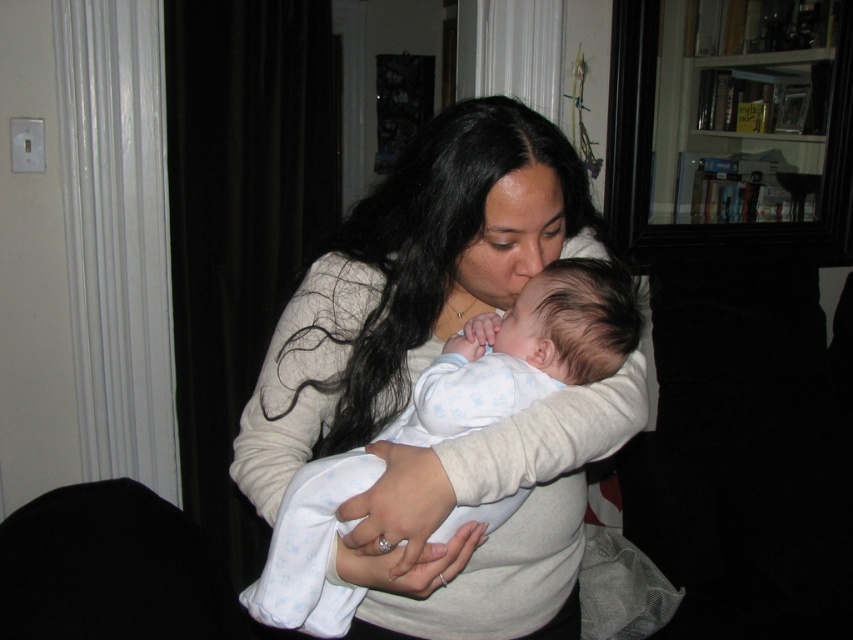
Consider the image. Is white soft sweater at center to the right of white soft baby at center from the viewer's perspective?

Incorrect, white soft sweater at center is not on the right side of white soft baby at center.

From the picture: How far apart are white soft sweater at center and white soft baby at center?

white soft sweater at center and white soft baby at center are 4.34 inches apart from each other.

Is point (483, 497) closer to viewer compared to point (567, 330)?

Yes, it is.

Identify the location of white soft sweater at center. click(426, 365).